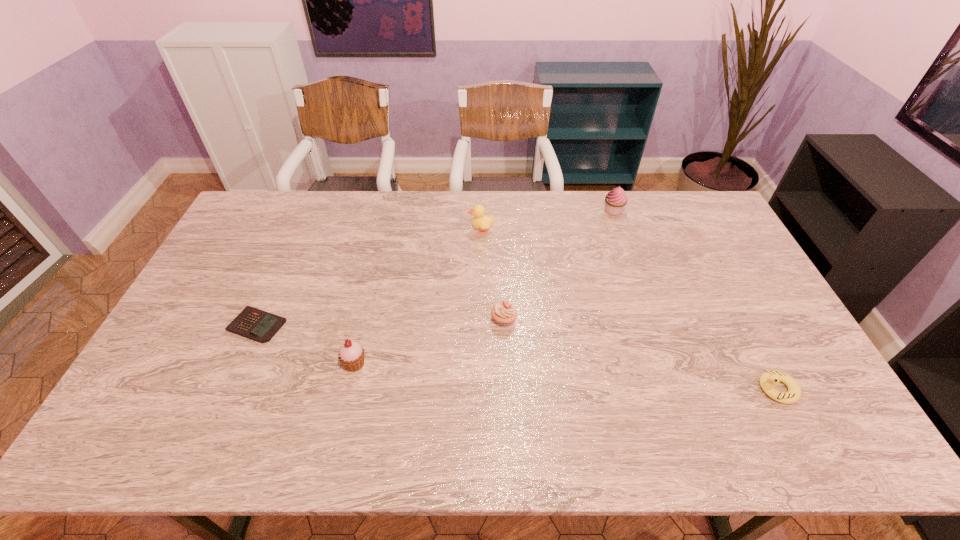
Locate which object ranks second in proximity to the shortest object. Please provide its 2D coordinates. Your answer should be formatted as a tuple, i.e. [(x, y)], where the tuple contains the x and y coordinates of a point satisfying the conditions above.

[(504, 312)]

At what (x,y) coordinates should I click in order to perform the action: click on the closest cupcake to the second farthest object. Please return your answer as a coordinate pair (x, y). Looking at the image, I should click on (504, 312).

Choose which cupcake is the nearest neighbor to the leftmost cupcake. Please provide its 2D coordinates. Your answer should be formatted as a tuple, i.e. [(x, y)], where the tuple contains the x and y coordinates of a point satisfying the conditions above.

[(504, 312)]

This screenshot has width=960, height=540. I want to click on vacant space that satisfies the following two spatial constraints: 1. on the front-facing side of the second cupcake from right to left; 2. on the left side of the left duckling, so click(x=481, y=319).